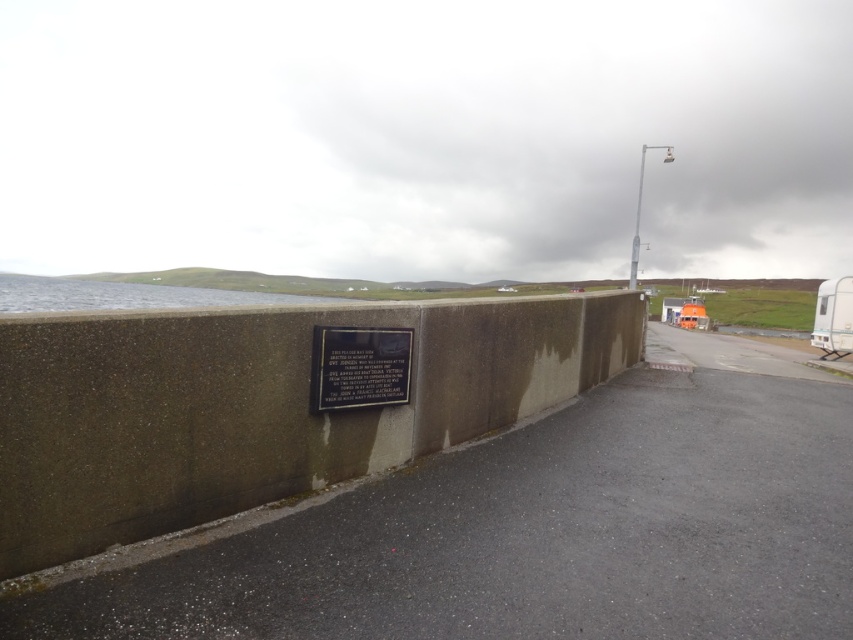
Who is shorter, concrete wall at center or black polished stone plaque at center?

Standing shorter between the two is black polished stone plaque at center.

Is point (112, 316) behind point (389, 333)?

No, (112, 316) is in front of (389, 333).

The width and height of the screenshot is (853, 640). Identify the location of concrete wall at center. (257, 406).

Between concrete wall at center and metallic pole at upper right, which one is positioned lower?

concrete wall at center is below.

Does concrete wall at center have a lesser width compared to metallic pole at upper right?

Yes.

Is point (30, 564) more distant than point (639, 237)?

No, it is not.

Identify the location of concrete wall at center. The height and width of the screenshot is (640, 853). point(257,406).

Can you confirm if black polished stone plaque at center is positioned above metallic pole at upper right?

Incorrect, black polished stone plaque at center is not positioned above metallic pole at upper right.

Between point (390, 401) and point (634, 269), which one is positioned in front?

Point (390, 401) is more forward.

I want to click on black polished stone plaque at center, so click(x=358, y=365).